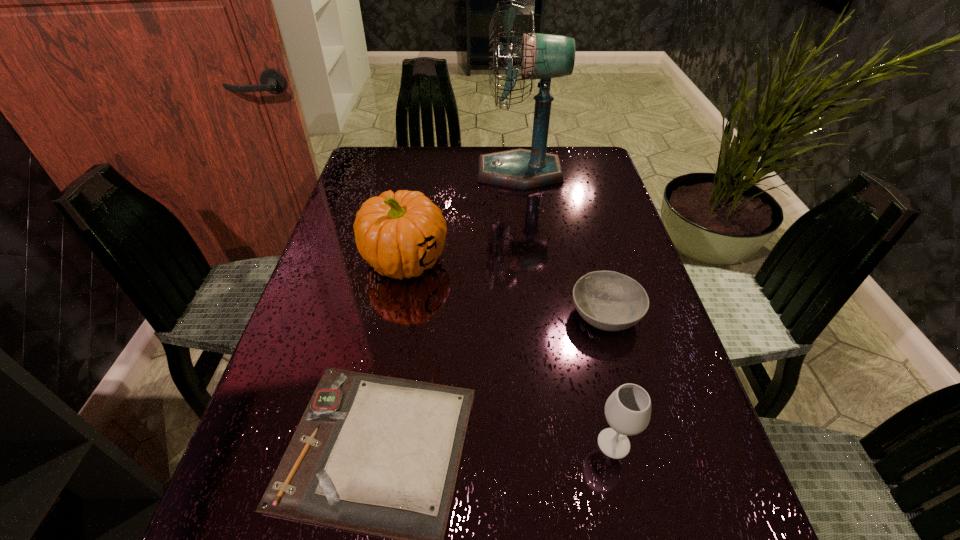
At what (x,y) coordinates should I click in order to perform the action: click on free point located on the back of the bowl. Please return your answer as a coordinate pair (x, y). The image size is (960, 540). Looking at the image, I should click on (573, 197).

Locate an element on the screen. object present at the far edge is located at coordinates (543, 56).

Where is `object positioned at the left edge`? object positioned at the left edge is located at coordinates (400, 235).

Find the location of a particular element. The width and height of the screenshot is (960, 540). fan situated at the right edge is located at coordinates (543, 56).

Where is `wineglass located in the right edge section of the desktop`? This screenshot has width=960, height=540. wineglass located in the right edge section of the desktop is located at coordinates (628, 409).

Find the location of a particular element. bowl at the right edge is located at coordinates (611, 301).

Image resolution: width=960 pixels, height=540 pixels. I want to click on object located at the far right corner, so click(x=543, y=56).

Locate an element on the screen. The width and height of the screenshot is (960, 540). blank area at the far edge is located at coordinates (445, 168).

I want to click on vacant space at the left edge, so click(365, 275).

Image resolution: width=960 pixels, height=540 pixels. I want to click on vacant space at the right edge of the desktop, so click(x=604, y=384).